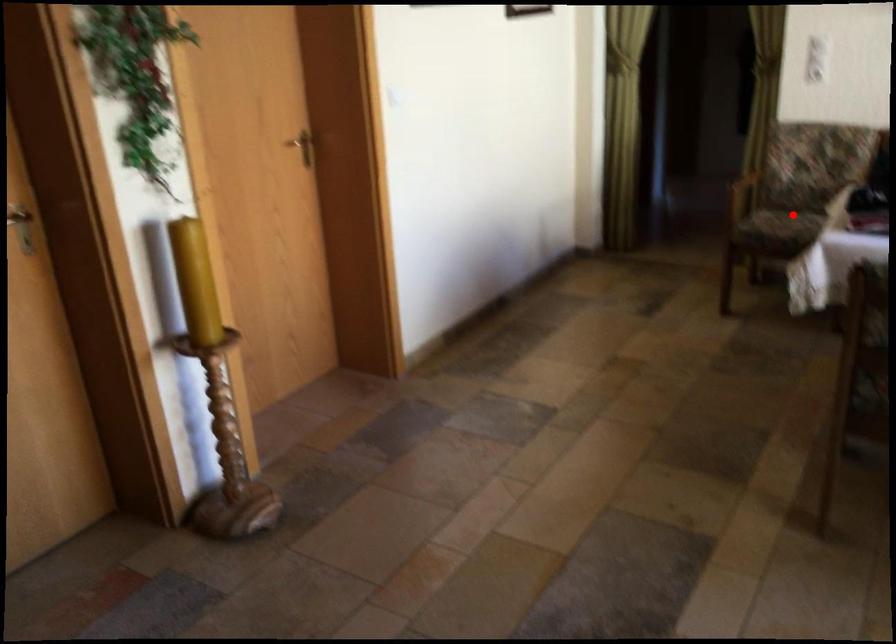
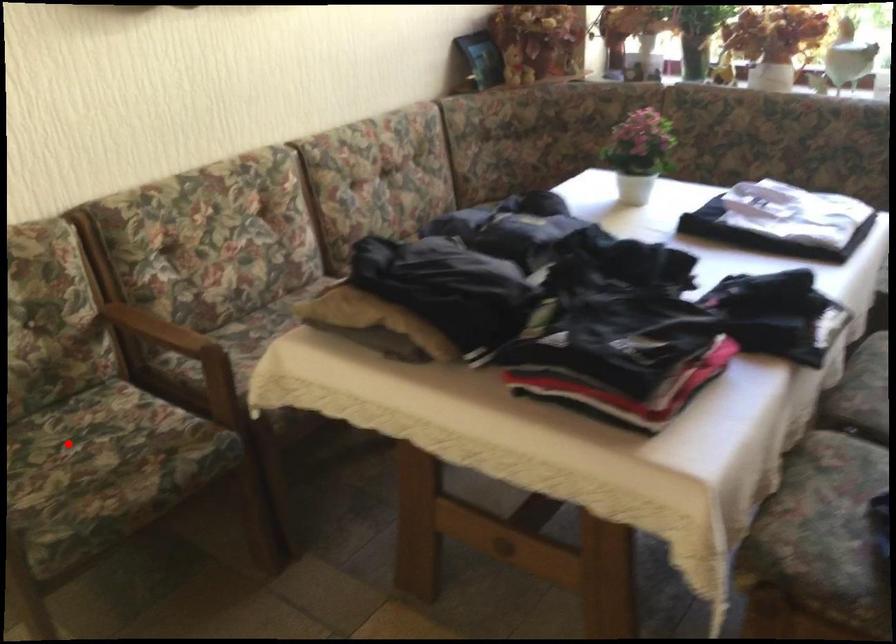
I am providing you with two images of the same scene from different viewpoints. A red point is marked on the first image and another point is marked on the second image. Are the points marked in image1 and image2 representing the same 3D position?

Yes